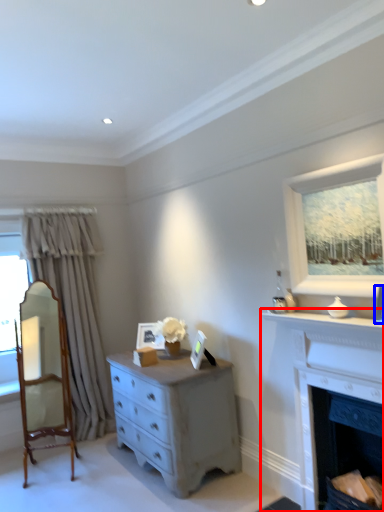
Question: Which object is further to the camera taking this photo, fireplace (highlighted by a red box) or picture frame (highlighted by a blue box)?

Choices:
 (A) fireplace
 (B) picture frame

Answer: (A)